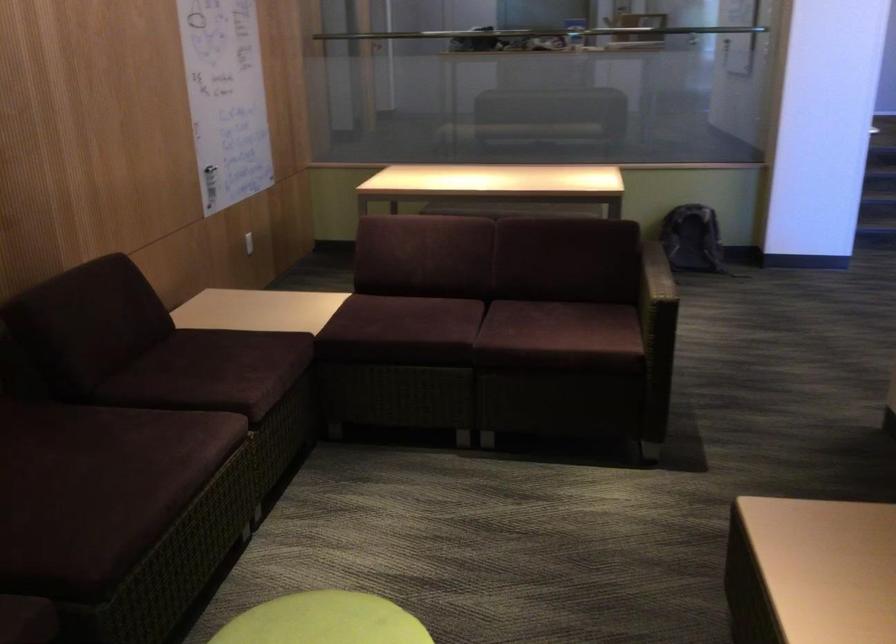
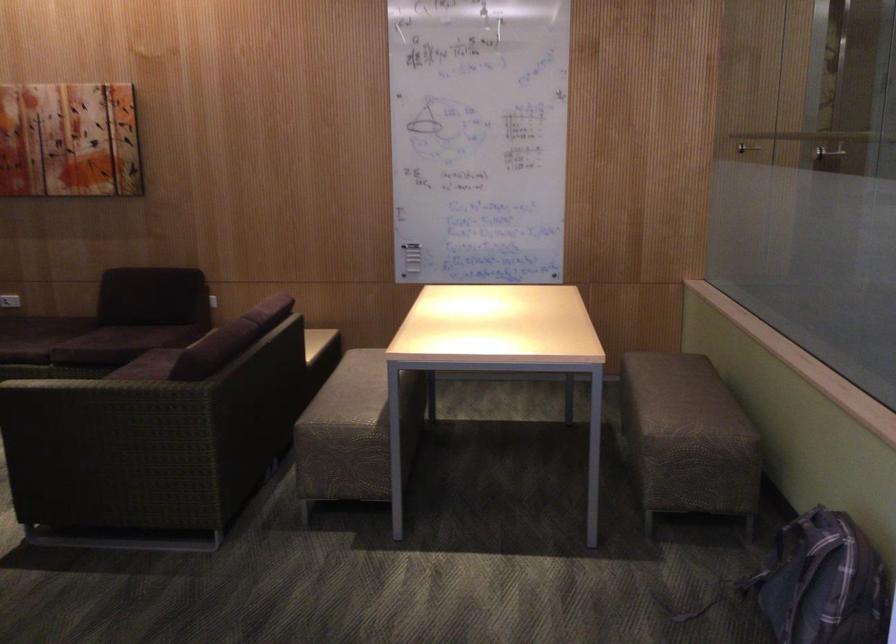
Where in the second image is the point corresponding to point (156, 363) from the first image?

(123, 322)